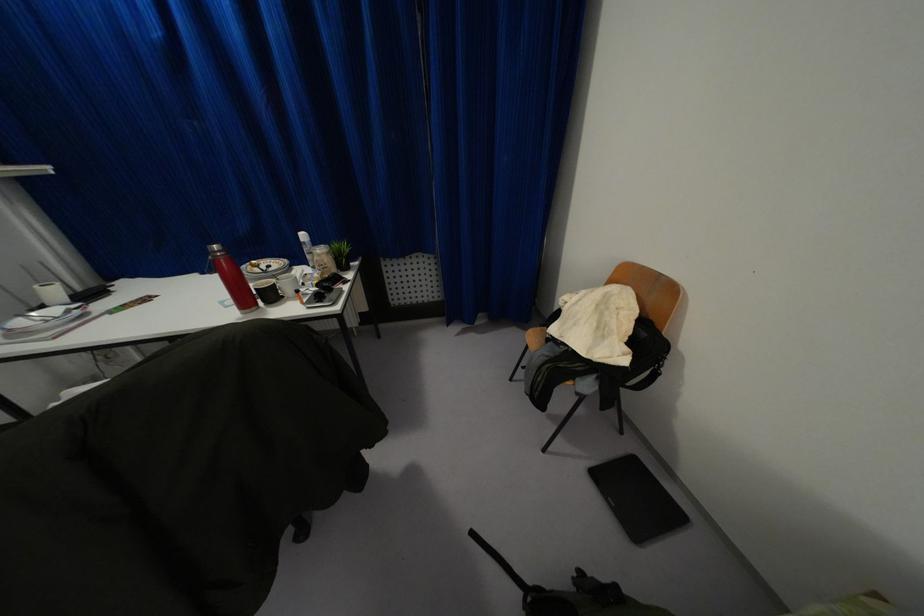
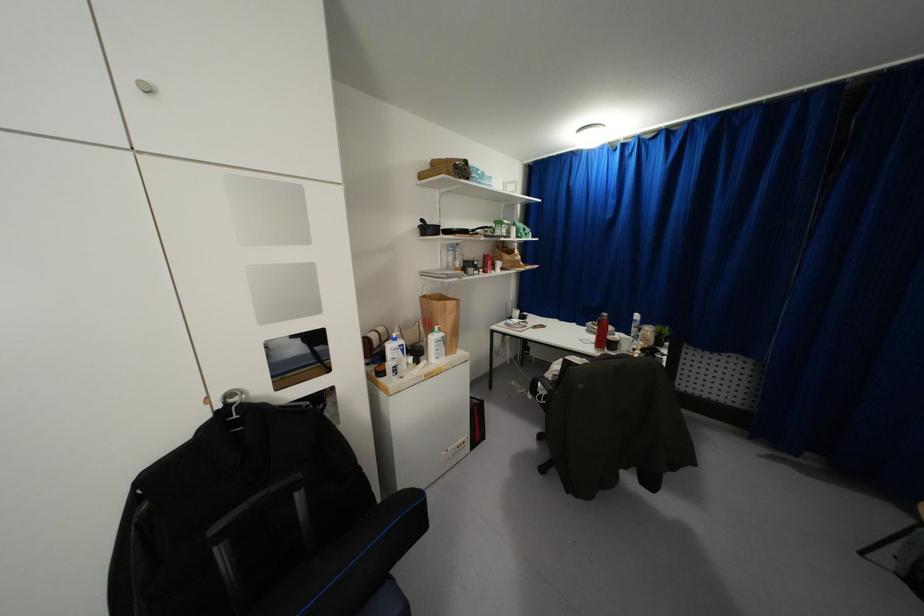
In the second image, find the point that corresponds to (214,246) in the first image.

(603, 314)